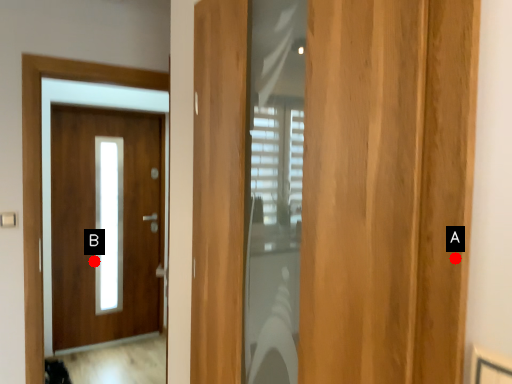
Question: Two points are circled on the image, labeled by A and B beside each circle. Which of the following is the closest to the observer?

Choices:
 (A) A is closer
 (B) B is closer

Answer: (A)